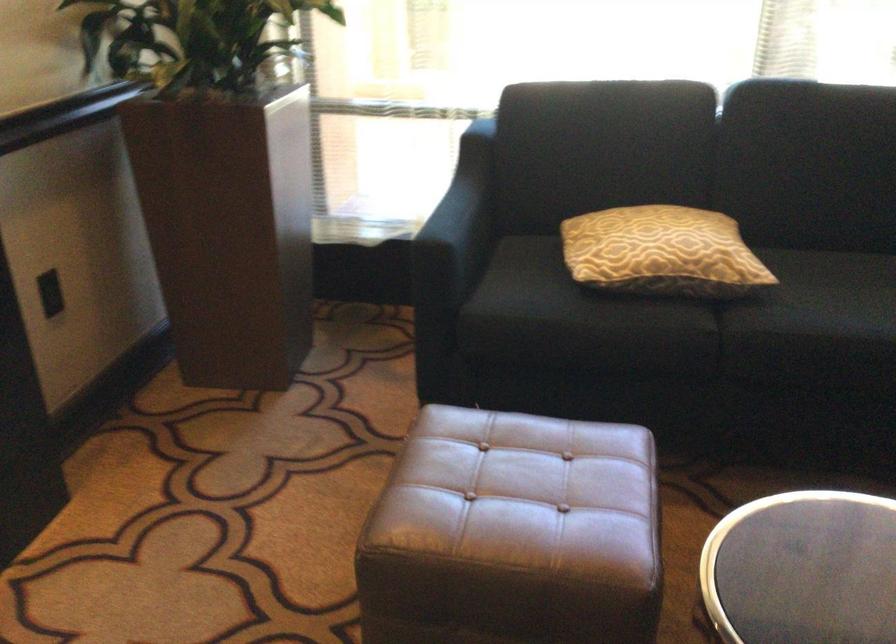
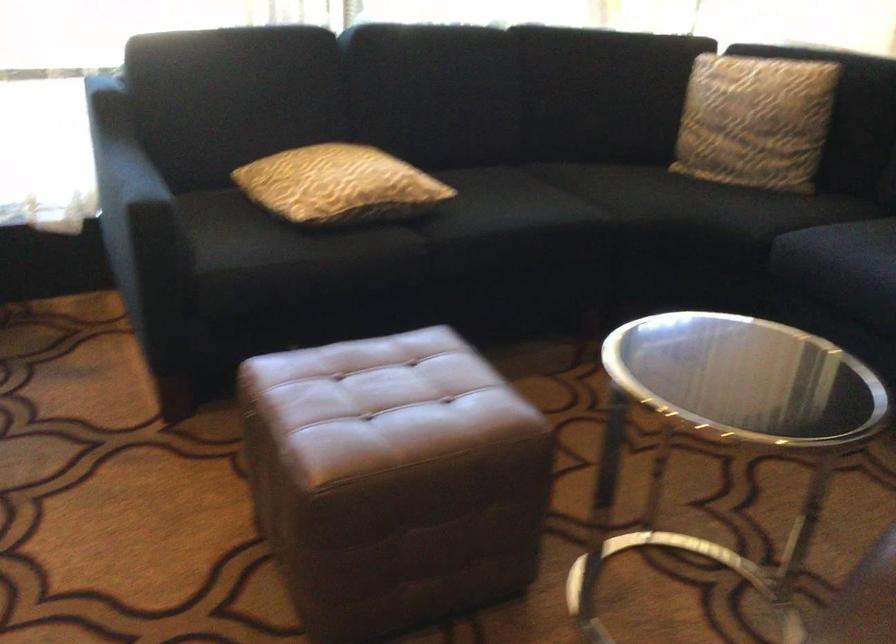
In the second image, find the point that corresponds to (443,569) in the first image.

(392, 480)